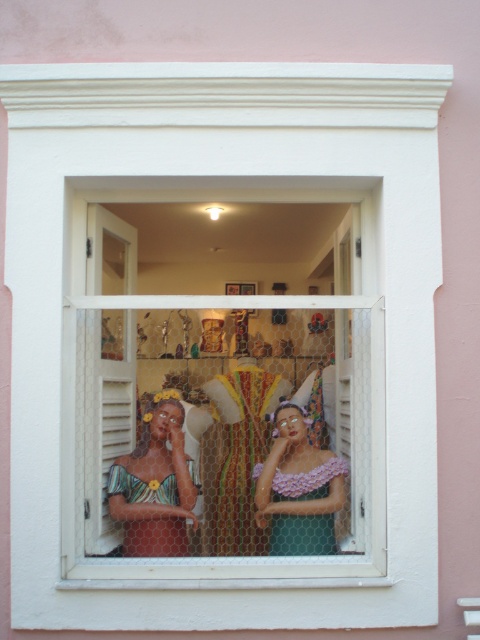
Looking at this image, you are a customer looking at the shop window. You notice two dresses displayed at the center. Which dress is closer to you, the multicolored fabric dress at center or the matte green dress at center?

The multicolored fabric dress at center is closer to you because it is in front of the matte green dress at center.

You are a customer looking at the shop window. You want to know which dress is bigger between the multicolored fabric dress at center and the matte green dress at center. Can you tell me?

The multicolored fabric dress at center is larger in size than the matte green dress at center, so the multicolored fabric dress at center is bigger.